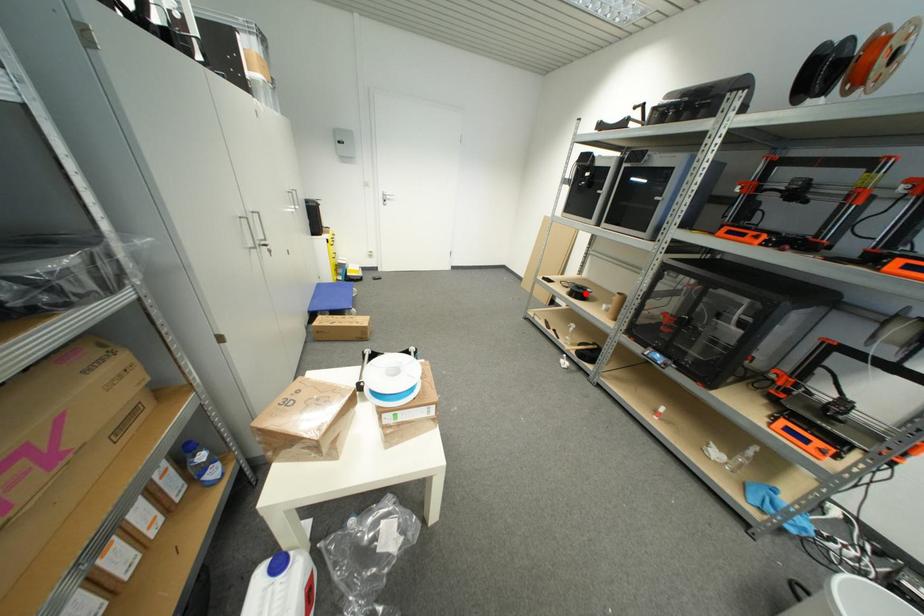
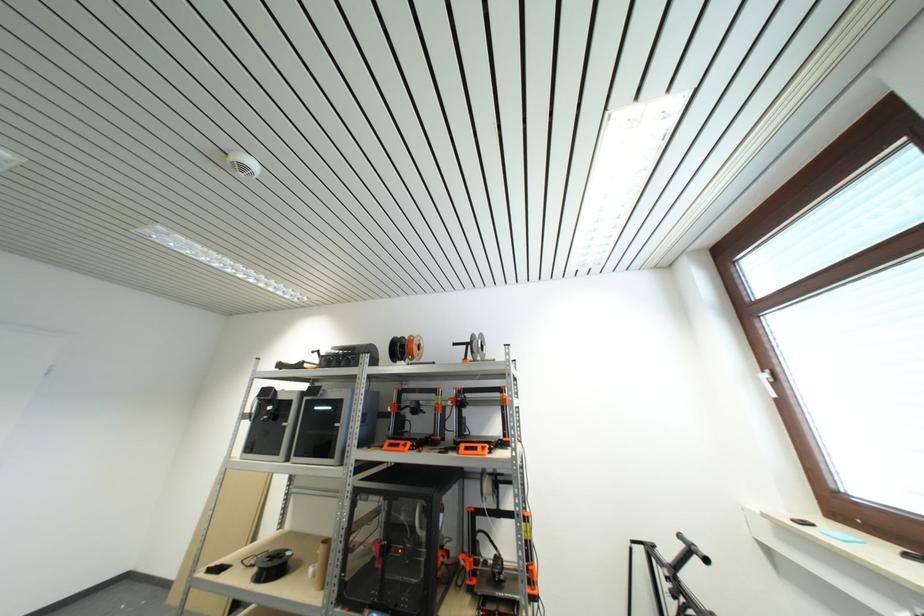
Question: A red point is marked in image1. In image2, is the corresponding 3D point closer to the camera or farther? Reply with the corresponding letter.

Choices:
 (A) The corresponding 3D point is closer.
 (B) The corresponding 3D point is farther.

Answer: (B)